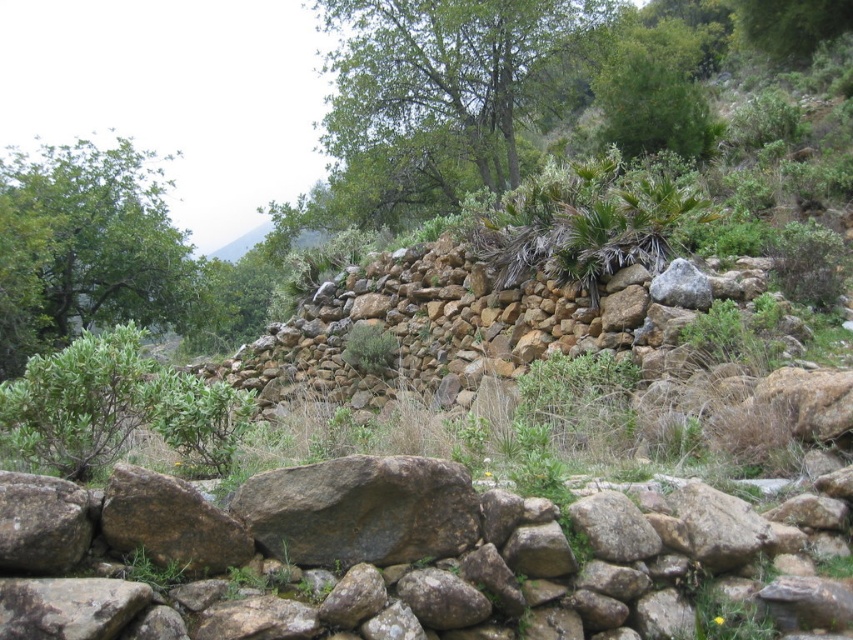
Question: Is green leafy tree at upper center wider than gray rough rock at center?

Choices:
 (A) yes
 (B) no

Answer: (A)

Question: Which point is closer to the camera taking this photo?

Choices:
 (A) (326, 499)
 (B) (404, 584)
 (C) (409, 150)
 (D) (167, 284)

Answer: (A)

Question: Which object is positioned farthest from the green leafy tree at upper center?

Choices:
 (A) green leafy tree at upper left
 (B) gray rough rock at center

Answer: (B)

Question: Is rusty stone wall at center positioned behind green leafy bush at lower left?

Choices:
 (A) yes
 (B) no

Answer: (B)

Question: Based on their relative distances, which object is nearer to the gray rough rock at center?

Choices:
 (A) green leafy bush at lower left
 (B) green leafy tree at upper left

Answer: (A)

Question: Does rusty stone wall at center appear on the left side of gray rough rock at center?

Choices:
 (A) yes
 (B) no

Answer: (B)